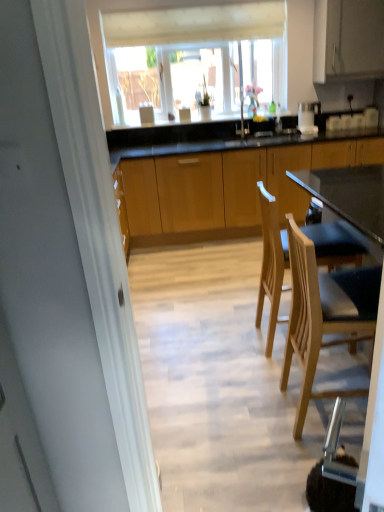
Question: Does transparent glass window at upper center have a lesser width compared to white matte cabinet at upper right, marked as the second cabinetry in a bottom-to-top arrangement?

Choices:
 (A) yes
 (B) no

Answer: (A)

Question: Would you say white matte cabinet at upper right, marked as the second cabinetry in a bottom-to-top arrangement, is part of transparent glass window at upper center's contents?

Choices:
 (A) no
 (B) yes

Answer: (A)

Question: Considering the relative sizes of transparent glass window at upper center and white matte cabinet at upper right, placed as the first cabinetry when sorted from top to bottom, in the image provided, is transparent glass window at upper center wider than white matte cabinet at upper right, placed as the first cabinetry when sorted from top to bottom,?

Choices:
 (A) no
 (B) yes

Answer: (A)

Question: Does transparent glass window at upper center touch white matte cabinet at upper right, marked as the second cabinetry in a bottom-to-top arrangement?

Choices:
 (A) no
 (B) yes

Answer: (A)

Question: From the image's perspective, is transparent glass window at upper center under white matte cabinet at upper right, placed as the first cabinetry when sorted from top to bottom?

Choices:
 (A) no
 (B) yes

Answer: (B)

Question: Based on their sizes in the image, would you say light wood chair at lower right, which is the second chair from back to front, is bigger or smaller than light wood chair at right, arranged as the second chair when viewed from the front?

Choices:
 (A) small
 (B) big

Answer: (A)

Question: Is point (317, 327) positioned closer to the camera than point (261, 217)?

Choices:
 (A) closer
 (B) farther

Answer: (A)

Question: Considering the relative positions of light wood chair at lower right, which is the second chair from back to front, and light wood chair at right, which appears as the first chair when viewed from the back, in the image provided, is light wood chair at lower right, which is the second chair from back to front, to the left or to the right of light wood chair at right, which appears as the first chair when viewed from the back,?

Choices:
 (A) right
 (B) left

Answer: (A)

Question: In the image, is light wood chair at lower right, positioned as the first chair in front-to-back order, positioned in front of or behind light wood chair at right, arranged as the second chair when viewed from the front?

Choices:
 (A) behind
 (B) front

Answer: (B)

Question: Considering the positions of point (354, 292) and point (99, 0), is point (354, 292) closer or farther from the camera than point (99, 0)?

Choices:
 (A) closer
 (B) farther

Answer: (A)

Question: Is light wood chair at lower right, positioned as the first chair in front-to-back order, inside the boundaries of transparent glass window at upper center, or outside?

Choices:
 (A) outside
 (B) inside

Answer: (A)

Question: Looking at the image, does light wood chair at lower right, which is the second chair from back to front, seem bigger or smaller compared to transparent glass window at upper center?

Choices:
 (A) big
 (B) small

Answer: (B)

Question: Would you say light wood chair at lower right, which is the second chair from back to front, is to the left or to the right of transparent glass window at upper center in the picture?

Choices:
 (A) left
 (B) right

Answer: (B)

Question: Is transparent glass window at upper center in front of or behind light wood chair at right, arranged as the second chair when viewed from the front, in the image?

Choices:
 (A) behind
 (B) front

Answer: (A)

Question: From the image's perspective, is transparent glass window at upper center positioned above or below light wood chair at right, which appears as the first chair when viewed from the back?

Choices:
 (A) below
 (B) above

Answer: (B)